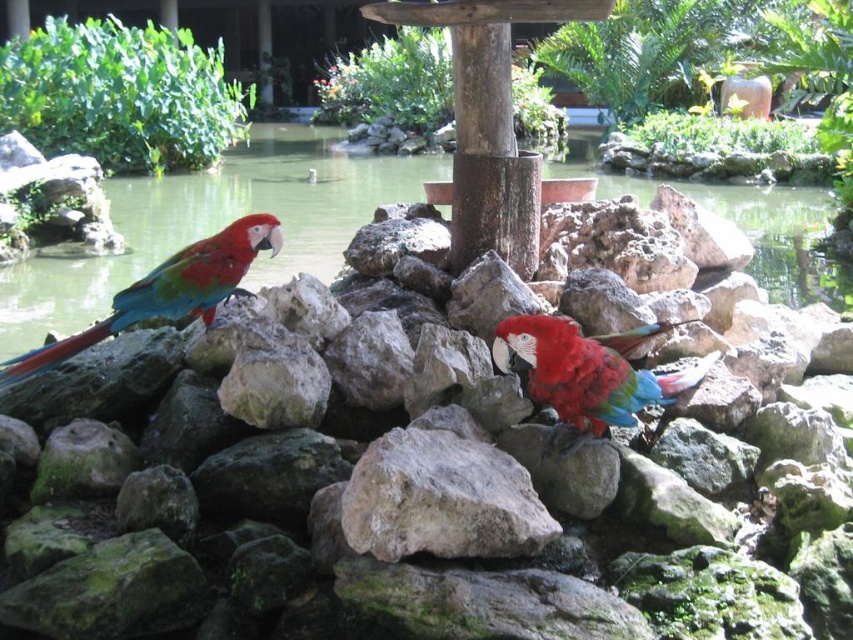
Which is below, greenish water at center or gray rough rock at center?

gray rough rock at center is below.

Is point (270, 170) positioned behind point (424, 515)?

Yes, point (270, 170) is behind point (424, 515).

Locate an element on the screen. The width and height of the screenshot is (853, 640). greenish water at center is located at coordinates (216, 224).

Find the location of a particular element. This screenshot has width=853, height=640. greenish water at center is located at coordinates (216, 224).

Looking at this image, between greenish water at center and shiny multicolored parrot at center, which one is positioned higher?

greenish water at center is higher up.

Is point (148, 212) positioned after point (495, 353)?

Yes, it is.

Locate an element on the screen. greenish water at center is located at coordinates (216, 224).

Which is more to the left, green mossy rock at center or gray rough rock at center?

gray rough rock at center

Is point (357, 465) positioned behind point (490, 509)?

Yes.

At what (x,y) coordinates should I click in order to perform the action: click on green mossy rock at center. Please return your answer as a coordinate pair (x, y). This screenshot has width=853, height=640. Looking at the image, I should click on (397, 496).